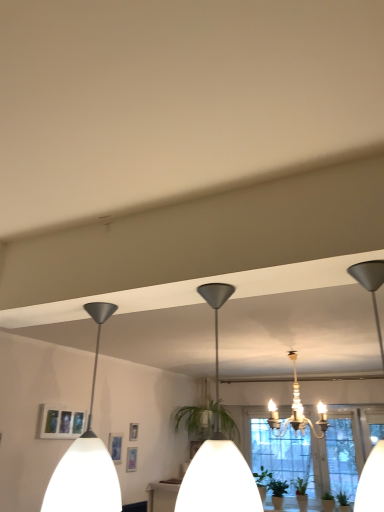
Question: Is matte black pendant light at center, which is the 2th lamp in left-to-right order, taller or shorter than white crystal chandelier at center, the third lamp in the left-to-right sequence?

Choices:
 (A) short
 (B) tall

Answer: (A)

Question: Is point (203, 494) closer or farther from the camera than point (294, 404)?

Choices:
 (A) closer
 (B) farther

Answer: (A)

Question: Which object is positioned closest to the white matte pendant light at left, arranged as the third lamp when viewed from the right?

Choices:
 (A) matte black pendant light at center, which ranks as the second lamp in right-to-left order
 (B) clear glass window at center
 (C) matte white picture frame at lower left
 (D) white crystal chandelier at center, acting as the 3th lamp starting from the front

Answer: (A)

Question: Considering the real-world distances, which object is farthest from the matte white picture frame at lower left?

Choices:
 (A) matte black pendant light at center, which is the 1th lamp in front-to-back order
 (B) white crystal chandelier at center, acting as the first lamp starting from the back
 (C) clear glass window at center
 (D) white matte pendant light at left, arranged as the third lamp when viewed from the right

Answer: (C)